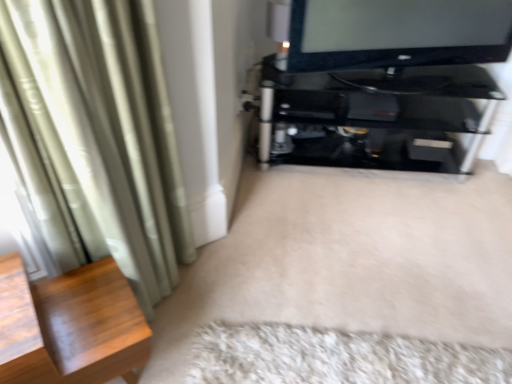
Question: From a real-world perspective, is black glossy television at upper right positioned above or below silky green curtain at left?

Choices:
 (A) below
 (B) above

Answer: (B)

Question: Does point (501, 8) appear closer or farther from the camera than point (121, 157)?

Choices:
 (A) closer
 (B) farther

Answer: (B)

Question: Estimate the real-world distances between objects in this image. Which object is farther from the black glossy television at upper right?

Choices:
 (A) white fluffy rug at lower center
 (B) black glass shelf at upper right
 (C) wooden side table at left
 (D) silky green curtain at left

Answer: (C)

Question: Which object is the farthest from the black glossy television at upper right?

Choices:
 (A) white fluffy rug at lower center
 (B) silky green curtain at left
 (C) black glass shelf at upper right
 (D) wooden side table at left

Answer: (D)